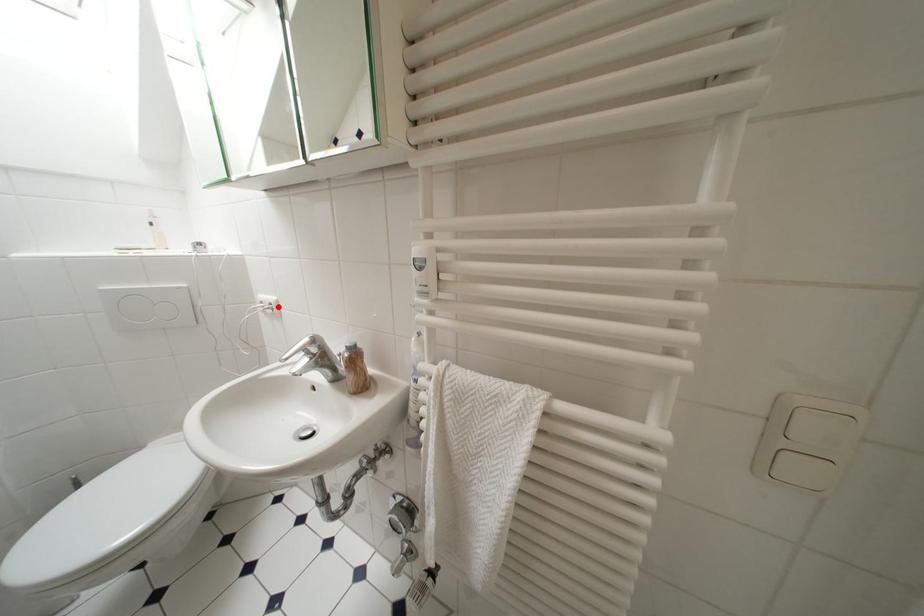
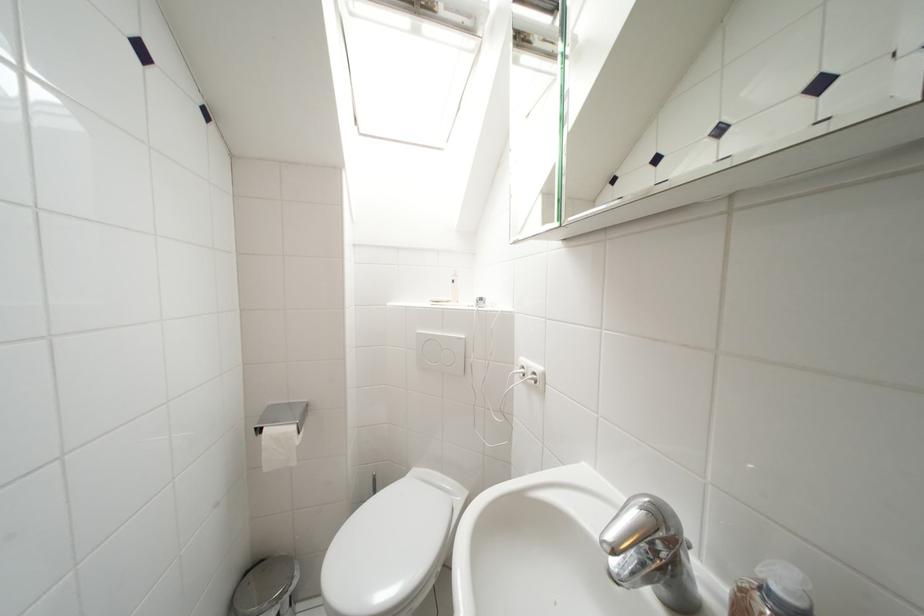
Question: I am providing you with two images of the same scene from different viewpoints. A red point is marked on the first image. At the location where the point appears in image 1, is it still visible in image 2?

Choices:
 (A) Yes
 (B) No

Answer: (A)